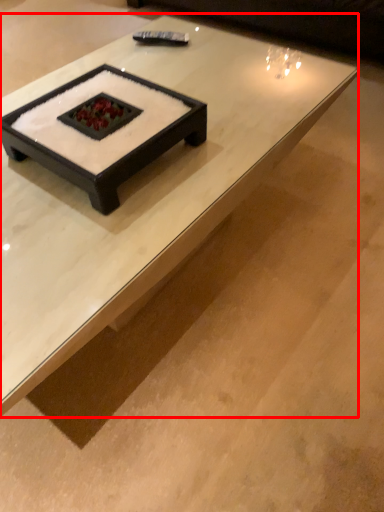
Question: From the image's perspective, what is the correct spatial relationship of coffee table (annotated by the red box) in relation to couch?

Choices:
 (A) below
 (B) above

Answer: (A)